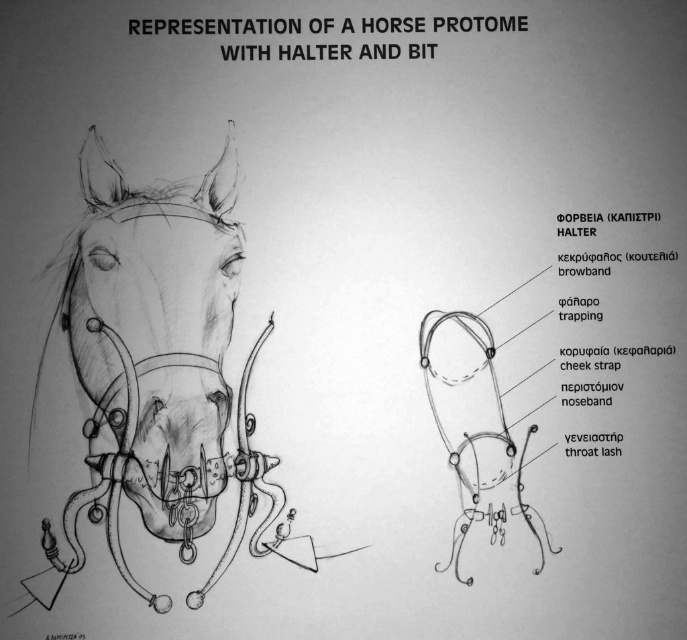
Is matte black horse head at center thinner than matte black muzzle at center?

In fact, matte black horse head at center might be wider than matte black muzzle at center.

Between matte black horse head at center and matte black muzzle at center, which one has less height?

With less height is matte black muzzle at center.

Is point (218, 328) positioned behind point (188, 445)?

Yes, point (218, 328) is behind point (188, 445).

The width and height of the screenshot is (687, 640). Find the location of `matte black horse head at center`. matte black horse head at center is located at coordinates (155, 332).